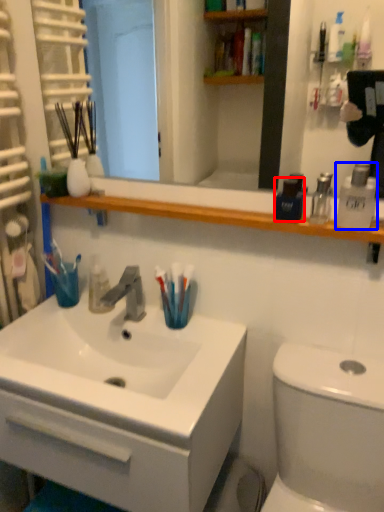
Question: Among these objects, which one is nearest to the camera, mouthwash (highlighted by a red box) or mouthwash (highlighted by a blue box)?

Choices:
 (A) mouthwash
 (B) mouthwash

Answer: (B)